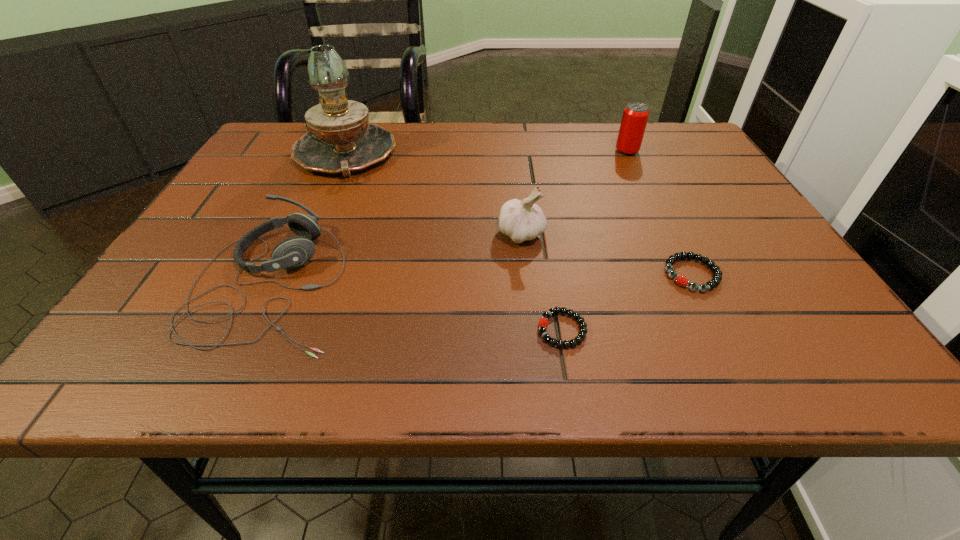
Locate an element on the screen. This screenshot has height=540, width=960. unoccupied position between the third shortest object and the right bracelet is located at coordinates (481, 279).

At what (x,y) coordinates should I click in order to perform the action: click on free space between the oil lamp and the can. Please return your answer as a coordinate pair (x, y). Looking at the image, I should click on point(486,153).

Find the location of a particular element. free spot between the taller bracelet and the third shortest object is located at coordinates (481, 279).

Locate an element on the screen. This screenshot has width=960, height=540. unoccupied area between the tallest object and the shorter bracelet is located at coordinates (453, 242).

Image resolution: width=960 pixels, height=540 pixels. In order to click on vacant space that's between the can and the shortest object in this screenshot , I will do `click(594, 240)`.

What are the coordinates of `vacant space that is in between the headset and the nearer bracelet` in the screenshot? It's located at (417, 306).

The height and width of the screenshot is (540, 960). I want to click on vacant area that lies between the tallest object and the garlic, so click(x=433, y=195).

Where is `vacant space that is in between the left bracelet and the headset`? vacant space that is in between the left bracelet and the headset is located at coordinates (417, 306).

Find the location of `the third closest object to the right bracelet`. the third closest object to the right bracelet is located at coordinates (635, 116).

Choose which object is the second nearest neighbor to the tallest object. Please provide its 2D coordinates. Your answer should be formatted as a tuple, i.e. [(x, y)], where the tuple contains the x and y coordinates of a point satisfying the conditions above.

[(524, 220)]